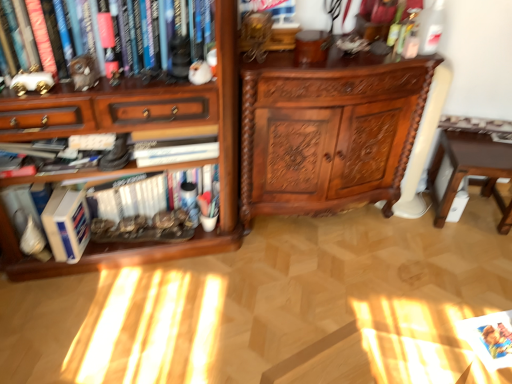
Question: Considering the relative sizes of wooden bookcase at left and brown wooden table at lower right in the image provided, is wooden bookcase at left smaller than brown wooden table at lower right?

Choices:
 (A) no
 (B) yes

Answer: (A)

Question: Is wooden bookcase at left placed right next to brown wooden table at lower right?

Choices:
 (A) yes
 (B) no

Answer: (B)

Question: From the image's perspective, is wooden bookcase at left located beneath brown wooden table at lower right?

Choices:
 (A) no
 (B) yes

Answer: (A)

Question: Does wooden bookcase at left appear on the left side of brown wooden table at lower right?

Choices:
 (A) yes
 (B) no

Answer: (A)

Question: From a real-world perspective, is wooden bookcase at left located beneath brown wooden table at lower right?

Choices:
 (A) yes
 (B) no

Answer: (B)

Question: In terms of size, does brown wooden table at lower right appear bigger or smaller than polished wood cabinet at center?

Choices:
 (A) small
 (B) big

Answer: (A)

Question: From a real-world perspective, is brown wooden table at lower right positioned above or below polished wood cabinet at center?

Choices:
 (A) above
 (B) below

Answer: (B)

Question: Is brown wooden table at lower right in front of or behind polished wood cabinet at center in the image?

Choices:
 (A) front
 (B) behind

Answer: (B)

Question: Considering the positions of brown wooden table at lower right and polished wood cabinet at center in the image, is brown wooden table at lower right taller or shorter than polished wood cabinet at center?

Choices:
 (A) short
 (B) tall

Answer: (A)

Question: Considering the relative positions of hardcover book at left, placed as the second book when sorted from front to back, and brown wooden table at lower right in the image provided, is hardcover book at left, placed as the second book when sorted from front to back, to the left or to the right of brown wooden table at lower right?

Choices:
 (A) right
 (B) left

Answer: (B)

Question: Choose the correct answer: Is hardcover book at left, the first book in the bottom-to-top sequence, inside brown wooden table at lower right or outside it?

Choices:
 (A) outside
 (B) inside

Answer: (A)

Question: Is hardcover book at left, placed as the second book when sorted from front to back, in front of or behind brown wooden table at lower right in the image?

Choices:
 (A) behind
 (B) front

Answer: (B)

Question: From the image's perspective, relative to brown wooden table at lower right, is hardcover book at left, the first book when ordered from back to front, above or below?

Choices:
 (A) below
 (B) above

Answer: (A)

Question: Considering their positions, is wooden bookcase at left located in front of or behind matte white figurine at upper left, placed as the second book when sorted from bottom to top?

Choices:
 (A) behind
 (B) front

Answer: (B)

Question: From the image's perspective, is wooden bookcase at left positioned above or below matte white figurine at upper left, placed as the second book when sorted from bottom to top?

Choices:
 (A) below
 (B) above

Answer: (A)